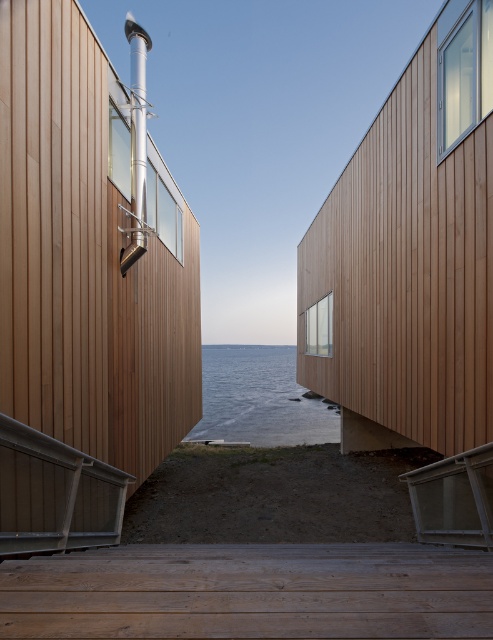
You are a maintenance worker needing to reach the wooden planks at center from the metallic gray balustrade at lower left. Can you walk directly between them without needing to move any objects?

The wooden planks at center and metallic gray balustrade at lower left are 3.73 feet apart, so yes, you can walk directly between them without needing to move any objects since the distance is sufficient for passage.

You are standing on the deck of the building and want to walk towards the water. Which object must you pass first, the metallic gray balustrade at lower left or the transparent water at center?

You must pass the metallic gray balustrade at lower left first because it is located to the left of the transparent water at center.

You are standing on the deck of the building and want to walk from the metallic gray balustrade at lower left to the transparent water at center. Which object is narrower, and will you have enough space to step over it?

The metallic gray balustrade at lower left is narrower than the transparent water at center. Since the balustrade is narrower, you should have enough space to step over it safely.